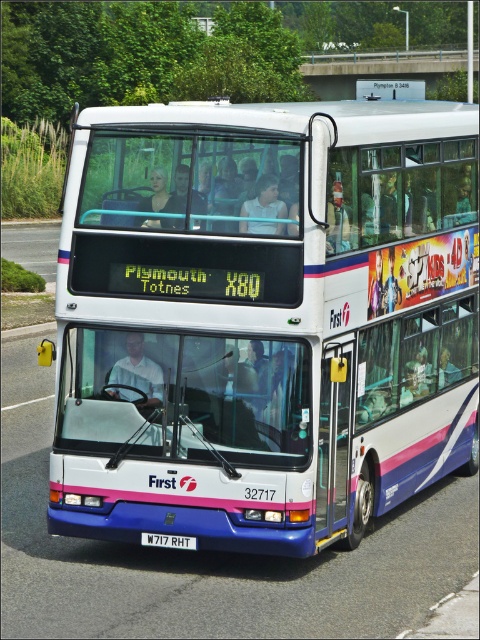
Question: Can you confirm if asphalt road at left is positioned to the left of white plastic license plate at center?

Choices:
 (A) no
 (B) yes

Answer: (B)

Question: Does asphalt road at left appear under white plastic license plate at center?

Choices:
 (A) yes
 (B) no

Answer: (B)

Question: Can you confirm if asphalt road at left is bigger than white plastic license plate at center?

Choices:
 (A) no
 (B) yes

Answer: (B)

Question: Which point is closer to the camera?

Choices:
 (A) white glossy decker bus at center
 (B) white plastic license plate at center
 (C) asphalt road at left

Answer: (A)

Question: Which point is closer to the camera?

Choices:
 (A) (143, 540)
 (B) (10, 221)

Answer: (A)

Question: Which of the following is the farthest from the observer?

Choices:
 (A) asphalt road at left
 (B) white glossy decker bus at center
 (C) white plastic license plate at center

Answer: (A)